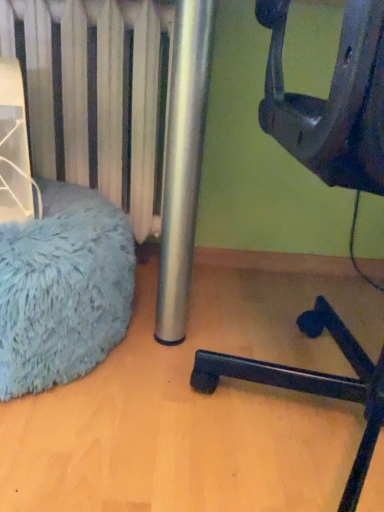
Question: From a real-world perspective, is blue fuzzy bean bag at left under black plastic chair at lower right?

Choices:
 (A) yes
 (B) no

Answer: (A)

Question: Is blue fuzzy bean bag at left positioned beyond the bounds of black plastic chair at lower right?

Choices:
 (A) yes
 (B) no

Answer: (A)

Question: Is blue fuzzy bean bag at left directly adjacent to black plastic chair at lower right?

Choices:
 (A) yes
 (B) no

Answer: (B)

Question: Considering the relative sizes of blue fuzzy bean bag at left and black plastic chair at lower right in the image provided, is blue fuzzy bean bag at left wider than black plastic chair at lower right?

Choices:
 (A) yes
 (B) no

Answer: (B)

Question: Could you tell me if blue fuzzy bean bag at left is turned towards black plastic chair at lower right?

Choices:
 (A) yes
 (B) no

Answer: (B)

Question: From the image's perspective, would you say blue fuzzy bean bag at left is positioned over black plastic chair at lower right?

Choices:
 (A) yes
 (B) no

Answer: (B)

Question: Considering the relative positions of black plastic chair at lower right and blue fuzzy bean bag at left in the image provided, is black plastic chair at lower right to the left of blue fuzzy bean bag at left from the viewer's perspective?

Choices:
 (A) no
 (B) yes

Answer: (A)

Question: Considering the relative positions of black plastic chair at lower right and blue fuzzy bean bag at left in the image provided, is black plastic chair at lower right in front of blue fuzzy bean bag at left?

Choices:
 (A) no
 (B) yes

Answer: (B)

Question: Considering the relative sizes of black plastic chair at lower right and blue fuzzy bean bag at left in the image provided, is black plastic chair at lower right wider than blue fuzzy bean bag at left?

Choices:
 (A) no
 (B) yes

Answer: (B)

Question: Is the surface of black plastic chair at lower right in direct contact with blue fuzzy bean bag at left?

Choices:
 (A) no
 (B) yes

Answer: (A)

Question: Can you confirm if black plastic chair at lower right is thinner than blue fuzzy bean bag at left?

Choices:
 (A) yes
 (B) no

Answer: (B)

Question: Can you confirm if black plastic chair at lower right is taller than blue fuzzy bean bag at left?

Choices:
 (A) yes
 (B) no

Answer: (A)

Question: From their relative heights in the image, would you say blue fuzzy bean bag at left is taller or shorter than black plastic chair at lower right?

Choices:
 (A) short
 (B) tall

Answer: (A)